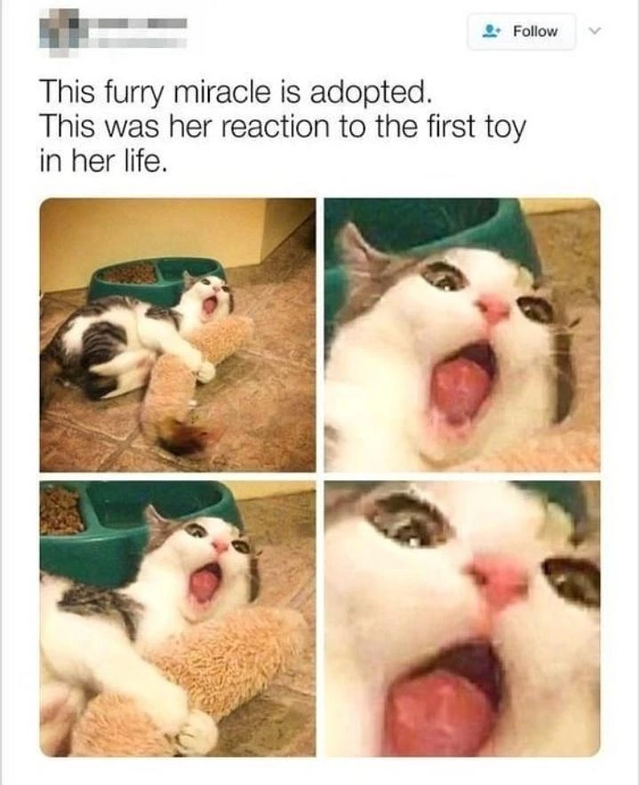
This screenshot has height=785, width=640. I want to click on cat toy, so click(171, 382), click(227, 669).